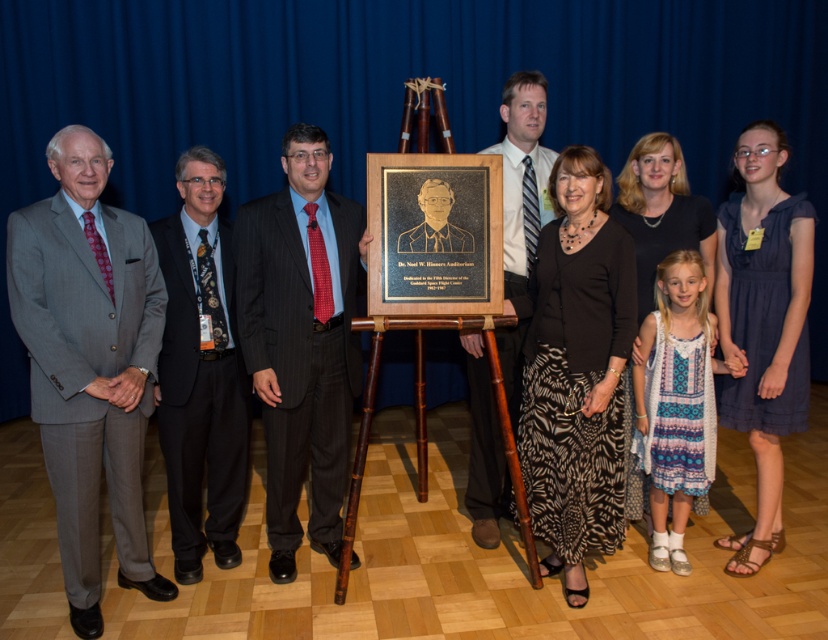
Is point (605, 196) positioned in front of point (215, 516)?

Yes, point (605, 196) is closer to viewer.

Looking at this image, measure the distance from black printed fabric skirt at center to dark gray suit at left.

They are 4.96 feet apart.

This screenshot has height=640, width=828. What do you see at coordinates (576, 371) in the screenshot? I see `black printed fabric skirt at center` at bounding box center [576, 371].

What are the coordinates of `black printed fabric skirt at center` in the screenshot? It's located at (576, 371).

Which is in front, point (590, 314) or point (422, 211)?

Point (590, 314)

This screenshot has width=828, height=640. What do you see at coordinates (576, 371) in the screenshot? I see `black printed fabric skirt at center` at bounding box center [576, 371].

Is point (532, 337) positioned in front of point (427, 248)?

No, it is not.

At what (x,y) coordinates should I click in order to perform the action: click on black printed fabric skirt at center. Please return your answer as a coordinate pair (x, y). The width and height of the screenshot is (828, 640). Looking at the image, I should click on [x=576, y=371].

Between dark blue dress at lower right and matte black suit at center, which one is positioned higher?

Positioned higher is matte black suit at center.

Measure the distance between point (776, 376) and camera.

The distance of point (776, 376) from camera is 9.07 feet.

Does point (777, 534) come in front of point (467, 340)?

No, it is not.

You are a GUI agent. You are given a task and a screenshot of the screen. Output one action in this format:
    pyautogui.click(x=<x>, y=<y>)
    Task: Click on the dark blue dress at lower right
    
    Given the screenshot: What is the action you would take?
    pyautogui.click(x=763, y=324)